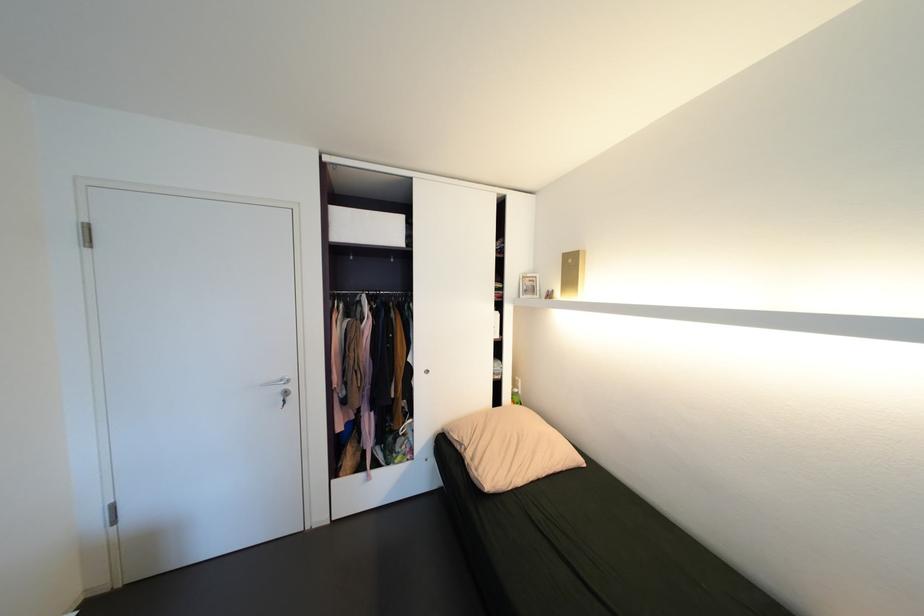
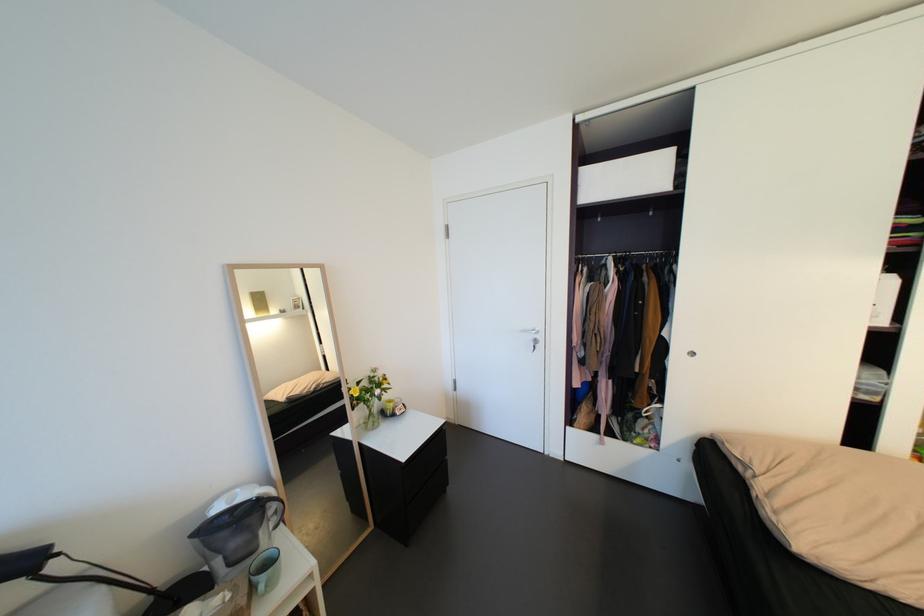
Where in the second image is the point corresponding to (x=299, y=398) from the first image?

(548, 346)